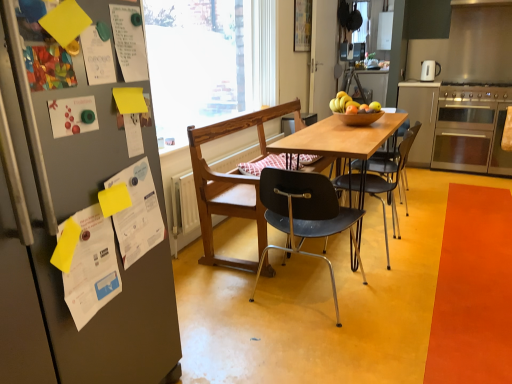
Where is `free space above white glossy electric kettle at upper right (from a real-world perspective)`? free space above white glossy electric kettle at upper right (from a real-world perspective) is located at coordinates (432, 55).